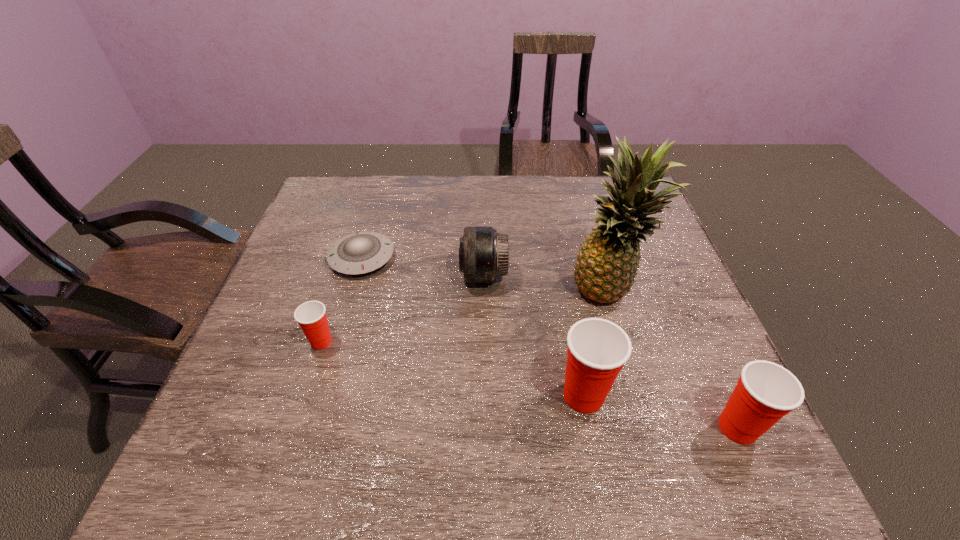
I want to click on spot to insert another Dixie_cup for uniform distribution, so click(445, 367).